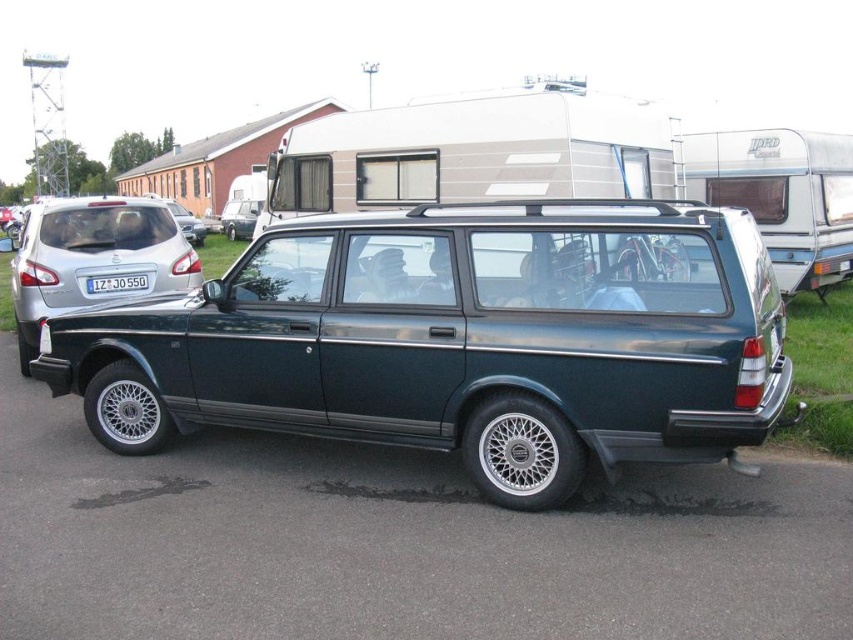
Which is more to the right, metallic green station wagon at center or matte silver car at upper left?

From the viewer's perspective, metallic green station wagon at center appears more on the right side.

Does metallic green station wagon at center have a lesser width compared to matte silver car at upper left?

Yes.

Image resolution: width=853 pixels, height=640 pixels. What do you see at coordinates (457, 340) in the screenshot?
I see `metallic green station wagon at center` at bounding box center [457, 340].

The image size is (853, 640). I want to click on metallic green station wagon at center, so click(457, 340).

Could you measure the distance between metallic green station wagon at center and white plastic license plate at center?

metallic green station wagon at center and white plastic license plate at center are 3.59 meters apart.

Based on the photo, can you confirm if metallic green station wagon at center is taller than white plastic license plate at center?

Yes.

Is point (299, 340) farther from viewer compared to point (125, 284)?

No, (299, 340) is in front of (125, 284).

I want to click on metallic green station wagon at center, so click(x=457, y=340).

Consider the image. Does metallic silver pickup truck at upper right have a lesser height compared to metallic silver car at left?

Yes, metallic silver pickup truck at upper right is shorter than metallic silver car at left.

Based on the photo, how much distance is there between metallic silver pickup truck at upper right and metallic silver car at left?

They are 11.28 meters apart.

From the picture: Who is more forward, (x=834, y=189) or (x=126, y=220)?

Point (x=126, y=220) is more forward.

At what (x,y) coordinates should I click in order to perform the action: click on metallic silver pickup truck at upper right. Please return your answer as a coordinate pair (x, y). The height and width of the screenshot is (640, 853). Looking at the image, I should click on (782, 195).